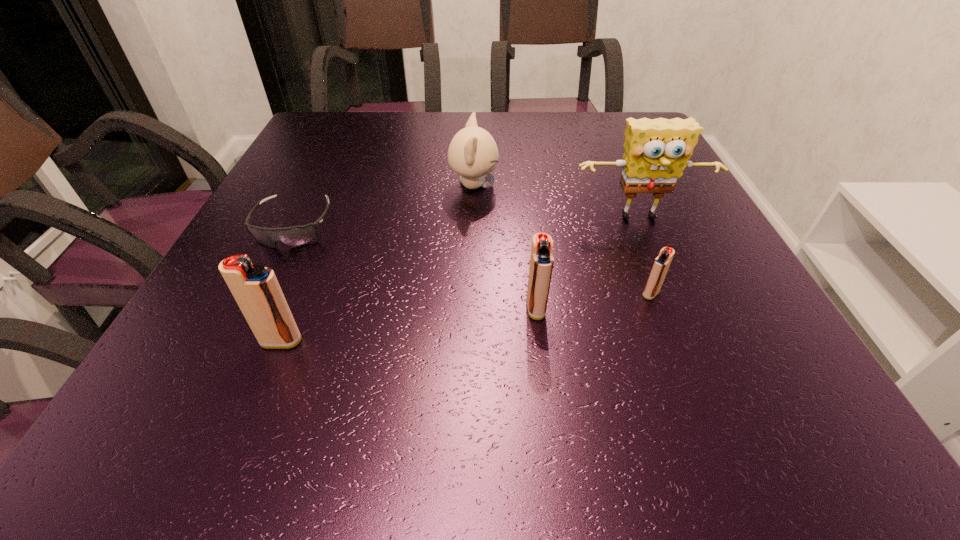
I want to click on vacant area that lies between the farthest object and the rightmost igniter, so click(x=563, y=240).

In order to click on free point between the second tallest igniter and the goggles in this screenshot , I will do `click(415, 267)`.

At what (x,y) coordinates should I click in order to perform the action: click on vacant area that lies between the fourth object from right to left and the rightmost igniter. Please return your answer as a coordinate pair (x, y). Looking at the image, I should click on (563, 240).

At what (x,y) coordinates should I click in order to perform the action: click on free spot between the nearest igniter and the shortest object. Please return your answer as a coordinate pair (x, y). Looking at the image, I should click on (287, 284).

At what (x,y) coordinates should I click in order to perform the action: click on free space between the rightmost igniter and the sponge. Please return your answer as a coordinate pair (x, y). Looking at the image, I should click on tap(645, 256).

Where is `the third closest object relative to the fifth tallest object`? the third closest object relative to the fifth tallest object is located at coordinates (473, 154).

In order to click on object that is the third closest to the kitten in this screenshot , I will do `click(541, 262)`.

Locate an element on the screen. The image size is (960, 540). igniter identified as the closest to the second igniter from right to left is located at coordinates pyautogui.click(x=661, y=264).

The width and height of the screenshot is (960, 540). Identify the location of igniter that is the closest to the second tallest igniter. (661, 264).

Image resolution: width=960 pixels, height=540 pixels. In order to click on vacant space that satisfies the following two spatial constraints: 1. on the face of the fourth object from right to left; 2. on the left side of the fourth object from left to right in this screenshot , I will do `click(471, 309)`.